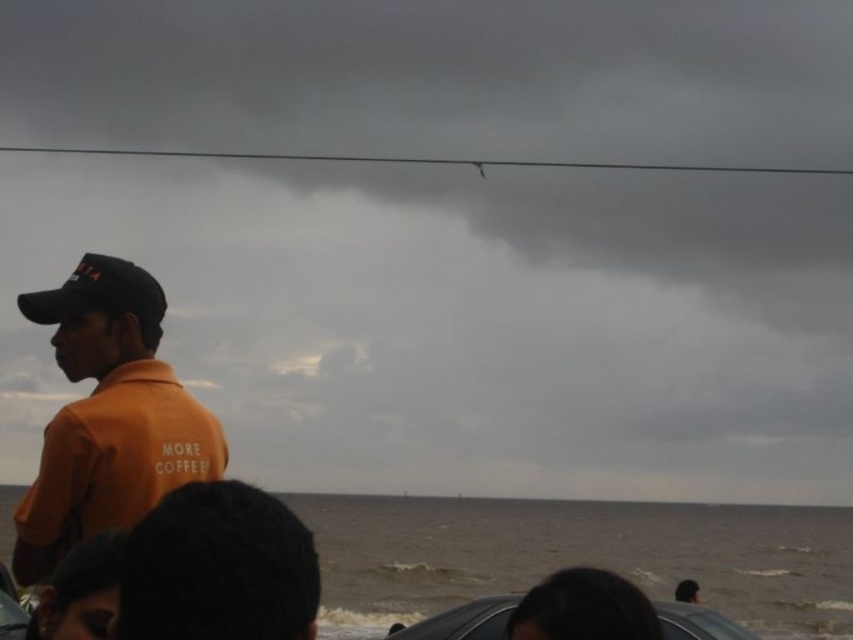
Question: Is the position of orange cotton shirt at left more distant than that of black matte baseball cap at left?

Choices:
 (A) yes
 (B) no

Answer: (B)

Question: Which of the following is the farthest from the observer?

Choices:
 (A) (804, 516)
 (B) (21, 296)
 (C) (178, 388)
 (D) (178, 528)

Answer: (A)

Question: Which object is positioned farthest from the orange cotton shirt at left?

Choices:
 (A) orange matte shirt at left
 (B) dark gray water at lower center
 (C) black matte baseball cap at left

Answer: (B)

Question: Observing the image, what is the correct spatial positioning of orange matte shirt at left in reference to black matte baseball cap at left?

Choices:
 (A) right
 (B) left

Answer: (B)

Question: Which point is closer to the camera taking this photo?

Choices:
 (A) (39, 314)
 (B) (131, 550)

Answer: (B)

Question: In this image, where is dark gray water at lower center located relative to black matte baseball cap at left?

Choices:
 (A) left
 (B) right

Answer: (B)